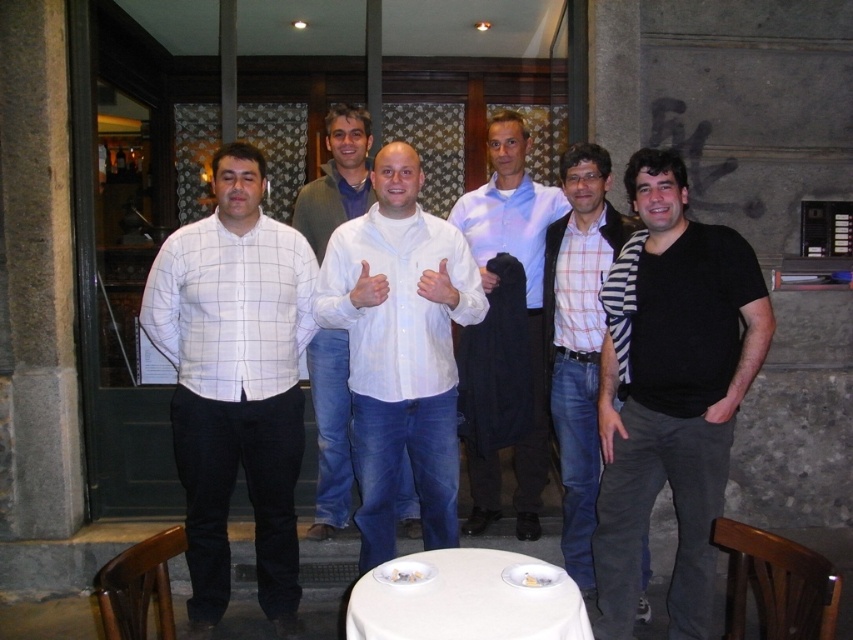
You are standing in front of the group of men in the image. You need to determine which of the two points, point (363, 464) or point (537, 182), is closer to you. Based on the scene description, which point is nearer?

Point (363, 464) is closer to the viewer than point (537, 182).